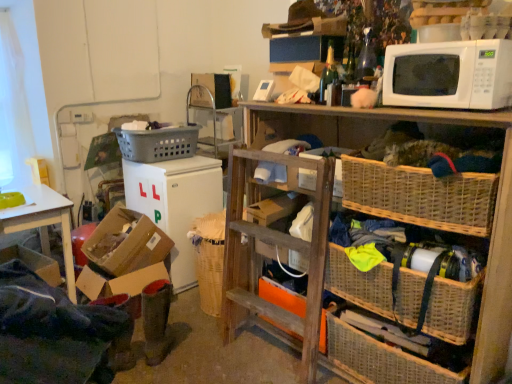
Question: Does gray plastic laundry basket at upper left, which ranks as the first picnic basket in top-to-bottom order, appear on the right side of cardboard box at lower left, the second box from the bottom?

Choices:
 (A) yes
 (B) no

Answer: (A)

Question: From a real-world perspective, is gray plastic laundry basket at upper left, which ranks as the first picnic basket in top-to-bottom order, physically above cardboard box at lower left, which is counted as the first box, starting from the top?

Choices:
 (A) no
 (B) yes

Answer: (B)

Question: Are gray plastic laundry basket at upper left, arranged as the 3th picnic basket when ordered from the bottom, and cardboard box at lower left, the second box from the bottom, located far from each other?

Choices:
 (A) no
 (B) yes

Answer: (A)

Question: Is the position of gray plastic laundry basket at upper left, arranged as the 3th picnic basket when ordered from the bottom, more distant than that of cardboard box at lower left, which is counted as the first box, starting from the top?

Choices:
 (A) yes
 (B) no

Answer: (A)

Question: From a real-world perspective, is gray plastic laundry basket at upper left, the 3th picnic basket when ordered from front to back, located beneath cardboard box at lower left, which is counted as the first box, starting from the top?

Choices:
 (A) yes
 (B) no

Answer: (B)

Question: From the image's perspective, is gray plastic laundry basket at upper left, arranged as the 3th picnic basket when ordered from the bottom, under cardboard box at lower left, which is counted as the first box, starting from the top?

Choices:
 (A) yes
 (B) no

Answer: (B)

Question: Considering the relative sizes of green felt boots at lower left and cardboard box at lower left, the second box from the bottom, in the image provided, is green felt boots at lower left taller than cardboard box at lower left, the second box from the bottom,?

Choices:
 (A) no
 (B) yes

Answer: (A)

Question: From the image's perspective, does green felt boots at lower left appear higher than cardboard box at lower left, which is counted as the first box, starting from the top?

Choices:
 (A) no
 (B) yes

Answer: (A)

Question: Does green felt boots at lower left have a greater width compared to cardboard box at lower left, which is counted as the first box, starting from the top?

Choices:
 (A) yes
 (B) no

Answer: (B)

Question: Is green felt boots at lower left looking in the opposite direction of cardboard box at lower left, which is counted as the first box, starting from the top?

Choices:
 (A) yes
 (B) no

Answer: (B)

Question: Is cardboard box at lower left, the second box from the bottom, located within green felt boots at lower left?

Choices:
 (A) yes
 (B) no

Answer: (B)

Question: From a real-world perspective, is green felt boots at lower left beneath cardboard box at lower left, the second box from the bottom?

Choices:
 (A) no
 (B) yes

Answer: (B)

Question: Can orange cardboard box at center be found inside woven wood shelf at upper right?

Choices:
 (A) yes
 (B) no

Answer: (A)